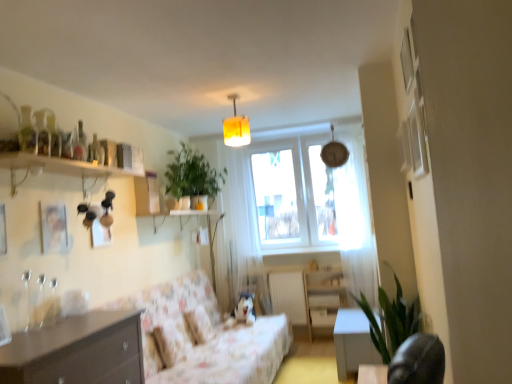
Identify the location of blank space situated above matte brown drawer at lower center (from a real-world perspective). (326, 309).